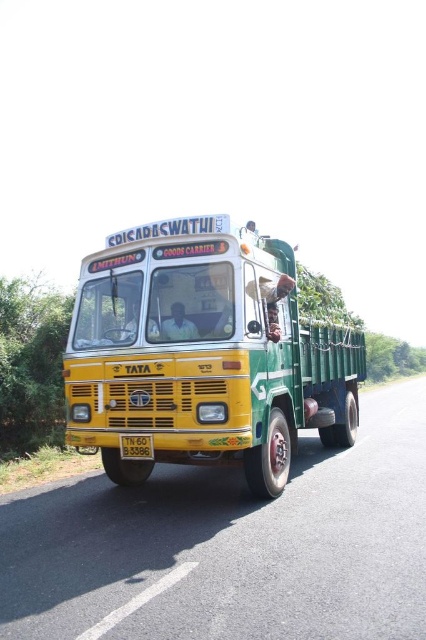
Between yellow metallic truck at center and smooth skin face at center, which one appears on the right side from the viewer's perspective?

Answer: From the viewer's perspective, yellow metallic truck at center appears more on the right side.

Is point (173, 506) positioned after point (158, 324)?

Yes, point (173, 506) is behind point (158, 324).

You are a GUI agent. You are given a task and a screenshot of the screen. Output one action in this format:
    pyautogui.click(x=<x>, y=<y>)
    Task: Click on the yellow metallic truck at center
    This screenshot has height=640, width=426.
    Given the screenshot: What is the action you would take?
    (232, 545)

Between point (172, 339) and point (150, 330), which one is positioned behind?

The point (150, 330) is behind.

Is point (175, 301) positioned behind point (132, 323)?

No.

This screenshot has width=426, height=640. In order to click on matte black shirt at center in this screenshot , I will do `click(178, 324)`.

Identify the location of matte black shirt at center. This screenshot has width=426, height=640. (178, 324).

The image size is (426, 640). I want to click on matte black shirt at center, so click(x=178, y=324).

This screenshot has height=640, width=426. Describe the element at coordinates (178, 324) in the screenshot. I see `matte black shirt at center` at that location.

What do you see at coordinates (178, 324) in the screenshot?
I see `matte black shirt at center` at bounding box center [178, 324].

Locate an element on the screen. The height and width of the screenshot is (640, 426). matte black shirt at center is located at coordinates (178, 324).